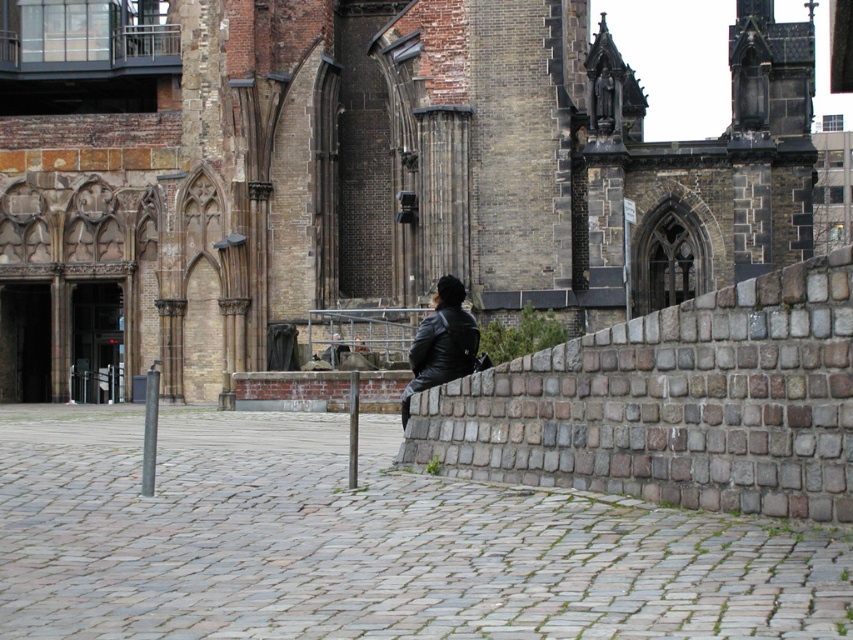
Question: Is brown stone church at center smaller than black leather jacket at center?

Choices:
 (A) no
 (B) yes

Answer: (A)

Question: Which object appears farthest from the camera in this image?

Choices:
 (A) brown stone church at center
 (B) black leather jacket at center

Answer: (A)

Question: Can you confirm if brown stone church at center is bigger than black leather jacket at center?

Choices:
 (A) no
 (B) yes

Answer: (B)

Question: Which of the following is the closest to the observer?

Choices:
 (A) black leather jacket at center
 (B) brown stone church at center

Answer: (A)

Question: Can you confirm if brown stone church at center is smaller than black leather jacket at center?

Choices:
 (A) yes
 (B) no

Answer: (B)

Question: Which of the following is the closest to the observer?

Choices:
 (A) (91, 340)
 (B) (424, 358)

Answer: (B)